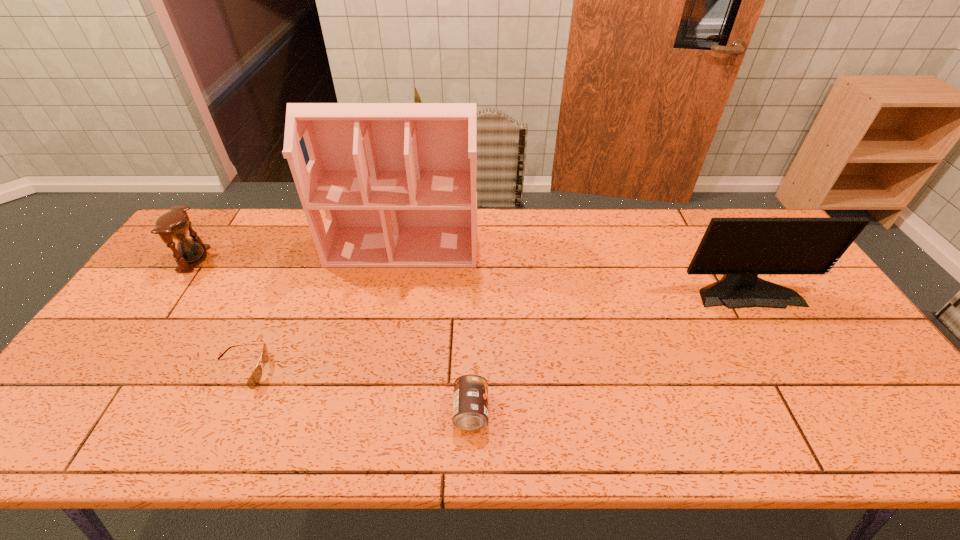
Find the location of a particular element. The width and height of the screenshot is (960, 540). dollhouse is located at coordinates (397, 181).

Where is `the rightmost object`? This screenshot has width=960, height=540. the rightmost object is located at coordinates (740, 249).

At what (x,y) coordinates should I click in order to perform the action: click on monitor. Please return your answer as a coordinate pair (x, y). Looking at the image, I should click on (740, 249).

This screenshot has height=540, width=960. Find the location of `the third shortest object`. the third shortest object is located at coordinates (174, 224).

The height and width of the screenshot is (540, 960). In order to click on the leftmost object in this screenshot , I will do `click(174, 224)`.

Identify the location of the fourth tallest object. pos(470,405).

The height and width of the screenshot is (540, 960). I want to click on sunglasses, so click(x=255, y=378).

At what (x,y) coordinates should I click in order to perform the action: click on the fourth object from right to left. Please return your answer as a coordinate pair (x, y). This screenshot has height=540, width=960. Looking at the image, I should click on (255, 378).

The width and height of the screenshot is (960, 540). What are the coordinates of `free space located on the front-facing side of the tallest object` in the screenshot? It's located at (377, 381).

I want to click on vacant space located 0.260m on the screen side of the fourth shortest object, so click(806, 390).